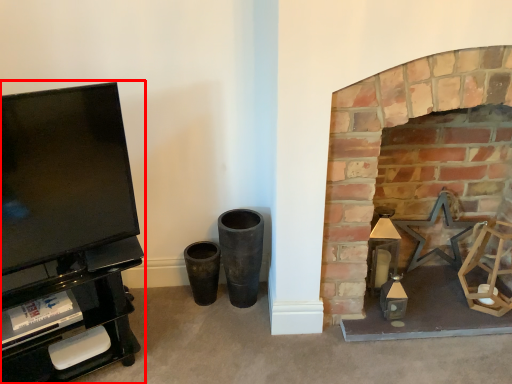
Question: Considering the relative positions of entertainment center (annotated by the red box) and fireplace in the image provided, where is entertainment center (annotated by the red box) located with respect to the staircase?

Choices:
 (A) left
 (B) right

Answer: (A)